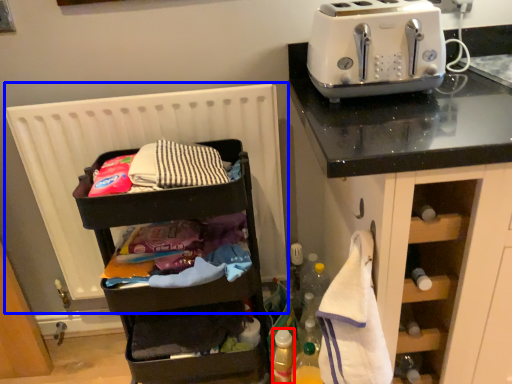
Question: Among these objects, which one is nearest to the camera, bottle (highlighted by a red box) or radiator (highlighted by a blue box)?

Choices:
 (A) bottle
 (B) radiator

Answer: (B)